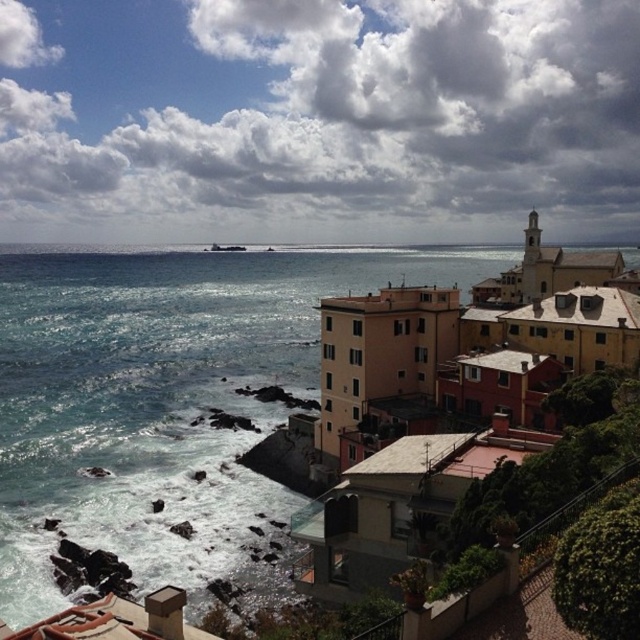
You are a tourist standing at the edge of the cliff overlooking the blue water at center and the matte yellow building at center. Which one appears taller from your vantage point?

The blue water at center appears taller than the matte yellow building at center from your vantage point.

You are a tourist standing on the rocky shore and want to take a photo of the matte yellow building at center and the blue water at center. Which object should you focus on first if you want to capture both in the same frame without moving your camera?

The blue water at center is wider than the matte yellow building at center, so you should focus on the matte yellow building at center first to ensure both fit in the frame.

You are standing on the rocky shore looking at the blue water at center and the matte yellow building at center. Which object is closer to you?

The blue water at center is closer to you than the matte yellow building at center because it is further away.